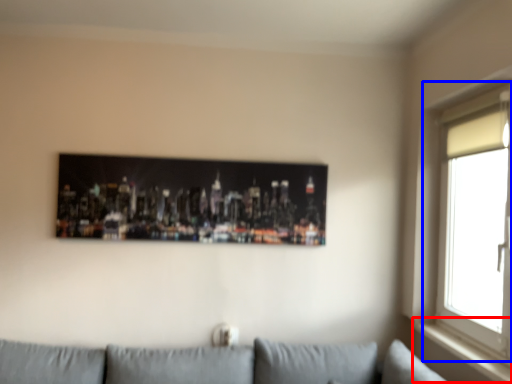
Question: Which object appears farthest to the camera in this image, window sill (highlighted by a red box) or window (highlighted by a blue box)?

Choices:
 (A) window sill
 (B) window

Answer: (A)